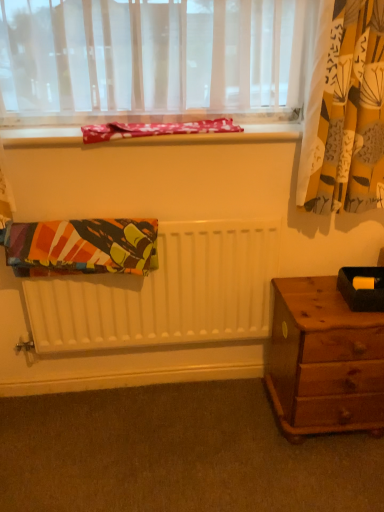
Question: Does wooden nightstand at lower right have a lesser width compared to multicolored fabric at center, the 2th blanket positioned from the top?

Choices:
 (A) no
 (B) yes

Answer: (A)

Question: Can you confirm if wooden nightstand at lower right is wider than multicolored fabric at center, the 2th blanket positioned from the top?

Choices:
 (A) yes
 (B) no

Answer: (A)

Question: Considering the relative sizes of wooden nightstand at lower right and multicolored fabric at center, acting as the first blanket starting from the bottom, in the image provided, is wooden nightstand at lower right shorter than multicolored fabric at center, acting as the first blanket starting from the bottom,?

Choices:
 (A) no
 (B) yes

Answer: (A)

Question: Is wooden nightstand at lower right smaller than multicolored fabric at center, the 2th blanket positioned from the top?

Choices:
 (A) yes
 (B) no

Answer: (B)

Question: Can you confirm if wooden nightstand at lower right is positioned to the right of multicolored fabric at center, acting as the first blanket starting from the bottom?

Choices:
 (A) no
 (B) yes

Answer: (B)

Question: Is wooden nightstand at lower right turned away from multicolored fabric at center, the 2th blanket positioned from the top?

Choices:
 (A) no
 (B) yes

Answer: (A)

Question: From a real-world perspective, does red floral fabric at upper center, which is the 2th blanket in bottom-to-top order, sit lower than black matte box at right?

Choices:
 (A) no
 (B) yes

Answer: (A)

Question: Considering the relative sizes of red floral fabric at upper center, the 1th blanket from the top, and black matte box at right in the image provided, is red floral fabric at upper center, the 1th blanket from the top, bigger than black matte box at right?

Choices:
 (A) no
 (B) yes

Answer: (B)

Question: Considering the relative sizes of red floral fabric at upper center, which is the 2th blanket in bottom-to-top order, and black matte box at right in the image provided, is red floral fabric at upper center, which is the 2th blanket in bottom-to-top order, taller than black matte box at right?

Choices:
 (A) no
 (B) yes

Answer: (A)

Question: Can you confirm if red floral fabric at upper center, which is the 2th blanket in bottom-to-top order, is thinner than black matte box at right?

Choices:
 (A) yes
 (B) no

Answer: (B)

Question: Is red floral fabric at upper center, which is the 2th blanket in bottom-to-top order, not within black matte box at right?

Choices:
 (A) yes
 (B) no

Answer: (A)

Question: Does red floral fabric at upper center, which is the 2th blanket in bottom-to-top order, have a smaller size compared to black matte box at right?

Choices:
 (A) no
 (B) yes

Answer: (A)

Question: Is carpet at lower center looking in the opposite direction of wooden nightstand at lower right?

Choices:
 (A) no
 (B) yes

Answer: (A)